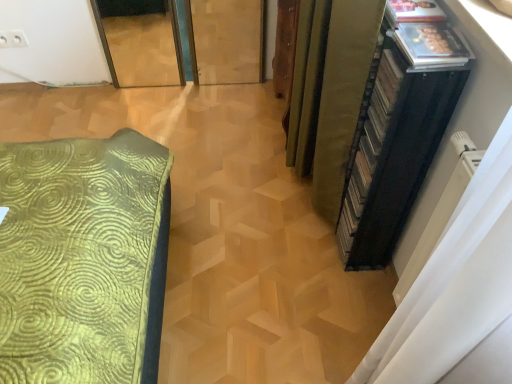
Where is `empty space that is ontop of black plastic file cabinet at right (from a real-world perspective)`? The image size is (512, 384). empty space that is ontop of black plastic file cabinet at right (from a real-world perspective) is located at coordinates (426, 38).